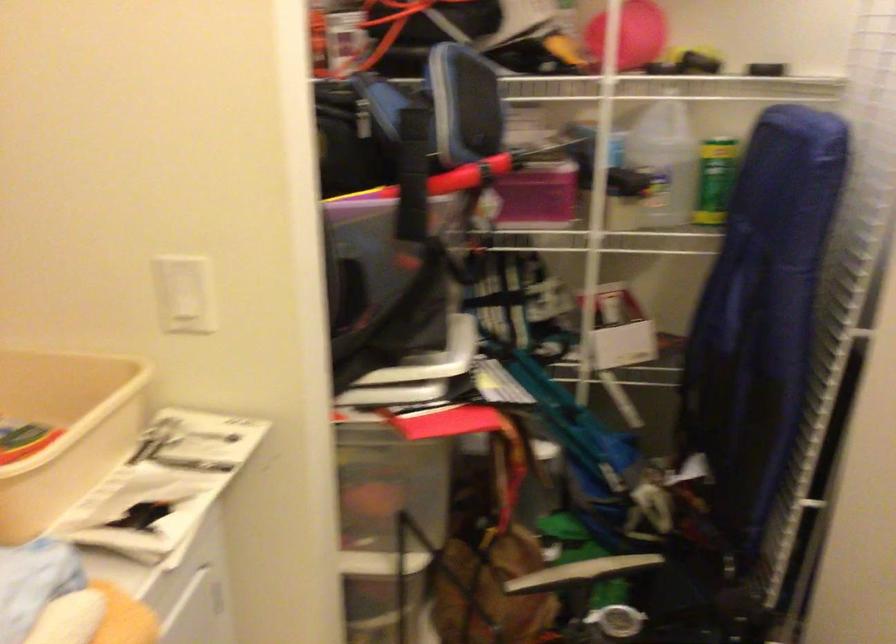
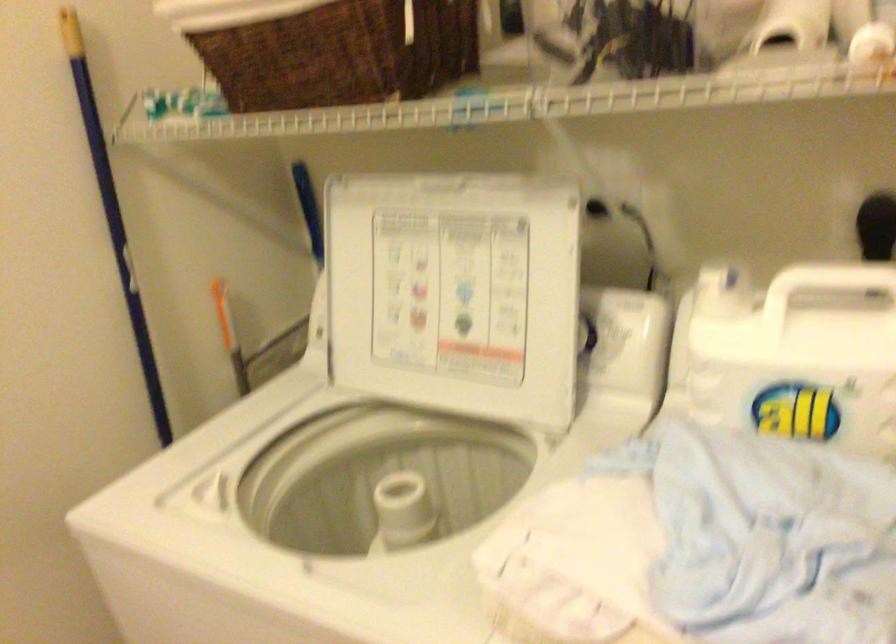
First-person continuous shooting, in which direction is the camera rotating?

The camera's rotation is toward left-down.